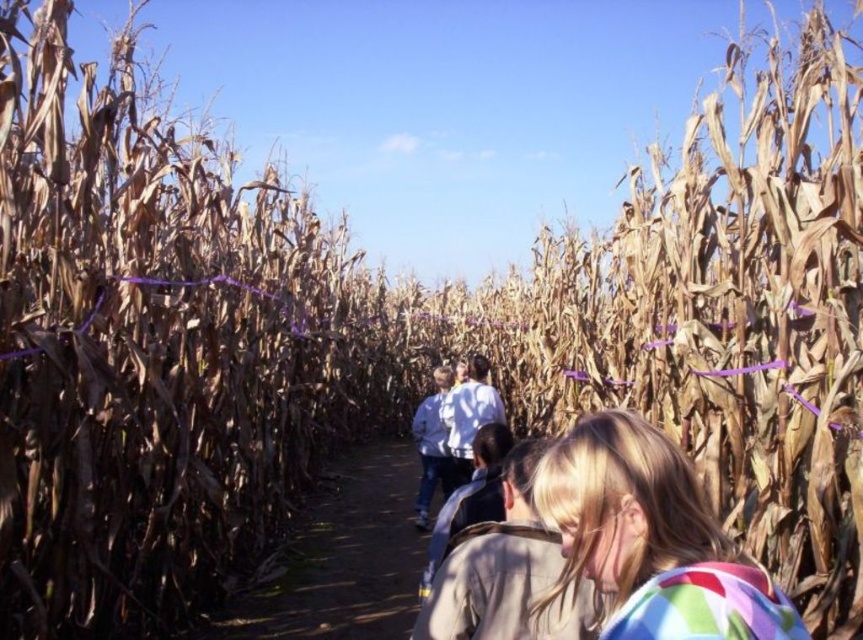
You are standing at the entrance of the corn maze and see the dirt path at center and the light blue denim jacket at center. Which object is closer to you?

The dirt path at center is shorter than light blue denim jacket at center, so the dirt path at center is closer to you.

You are standing at the entrance of the corn maze and see the dirt path at center and the light blue denim jacket at center. Which object is positioned to the left?

The dirt path at center is to the left of the light blue denim jacket at center.